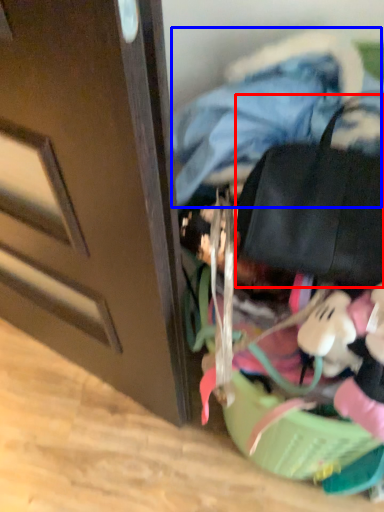
Question: Which point is further to the camera, messenger bag (highlighted by a red box) or clothing (highlighted by a blue box)?

Choices:
 (A) messenger bag
 (B) clothing

Answer: (B)